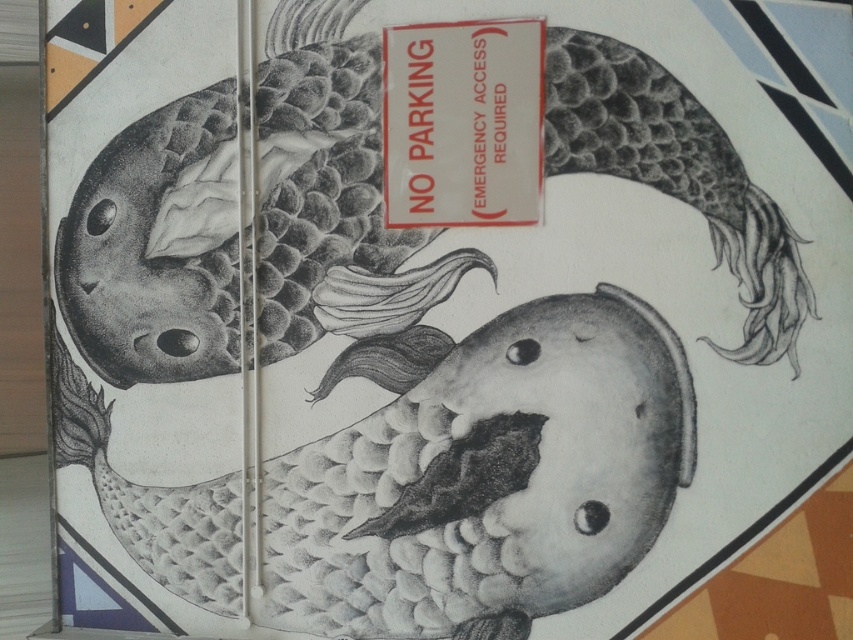
Question: Can you confirm if gray textured fish at center is thinner than white paper sign at upper center?

Choices:
 (A) no
 (B) yes

Answer: (A)

Question: Is gray textured fish at center bigger than white paper sign at upper center?

Choices:
 (A) no
 (B) yes

Answer: (B)

Question: Does gray textured fish at center lie in front of white paper sign at upper center?

Choices:
 (A) no
 (B) yes

Answer: (B)

Question: Among these objects, which one is farthest from the camera?

Choices:
 (A) gray textured fish at center
 (B) white paper sign at upper center

Answer: (B)